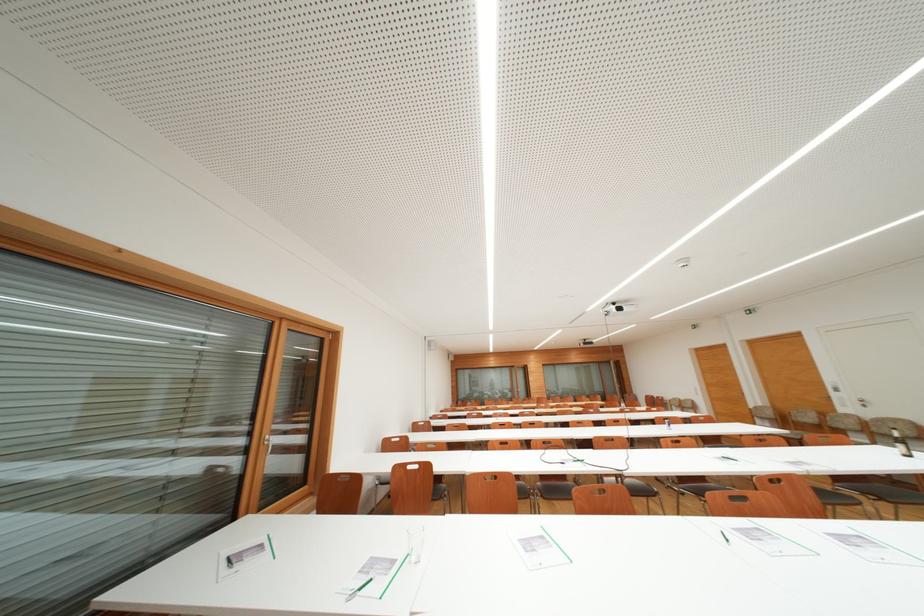
Image resolution: width=924 pixels, height=616 pixels. I want to click on drinking glass, so click(x=415, y=543).